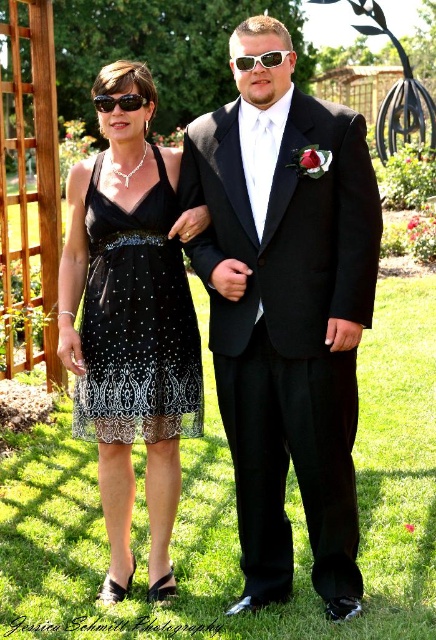
Which is more to the right, black satin suit at center or green grass at center?

green grass at center

Between point (230, 141) and point (367, 442), which one is positioned in front?

Point (230, 141)

Is point (329, 109) positioned in front of point (387, 284)?

Yes, it is in front of point (387, 284).

The image size is (436, 640). I want to click on black satin suit at center, so click(x=286, y=310).

Does green grass at center have a larger size compared to black lace dress at left?

Yes, green grass at center is bigger than black lace dress at left.

Does green grass at center come behind black lace dress at left?

No.

The image size is (436, 640). Identify the location of green grass at center. (235, 513).

I want to click on green grass at center, so click(235, 513).

Between black plastic sunglasses at upper left and sunglasses at center, which one is positioned lower?

black plastic sunglasses at upper left is below.

Does black plastic sunglasses at upper left appear on the right side of sunglasses at center?

No, black plastic sunglasses at upper left is not to the right of sunglasses at center.

Which is behind, point (143, 104) or point (241, 56)?

Positioned behind is point (143, 104).

Where is `black plastic sunglasses at upper left`? black plastic sunglasses at upper left is located at coordinates (119, 102).